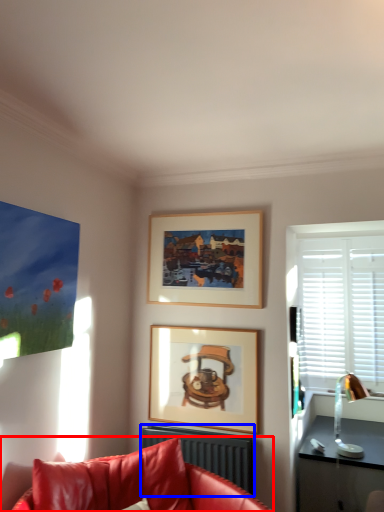
Question: Which object appears closest to the camera in this image, studio couch (highlighted by a red box) or radiator (highlighted by a blue box)?

Choices:
 (A) studio couch
 (B) radiator

Answer: (A)